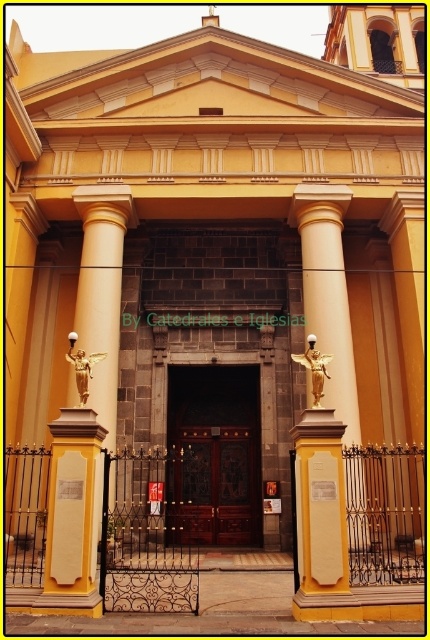
Question: Does gold metallic angel at right appear under gold metallic statue at center?

Choices:
 (A) yes
 (B) no

Answer: (B)

Question: From the image, what is the correct spatial relationship of gold metallic angel at right in relation to gold metallic statue at center?

Choices:
 (A) left
 (B) right

Answer: (B)

Question: From the image, what is the correct spatial relationship of gold metallic angel at right in relation to gold metallic statue at center?

Choices:
 (A) below
 (B) above

Answer: (B)

Question: Which object appears farthest from the camera in this image?

Choices:
 (A) gold metallic angel at right
 (B) gold metallic statue at center

Answer: (B)